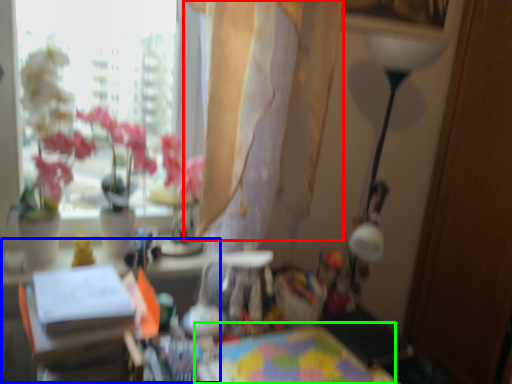
Question: Which object is the closest to the curtain (highlighted by a red box)? Choose among these: table (highlighted by a blue box) or table (highlighted by a green box).

Choices:
 (A) table
 (B) table

Answer: (A)